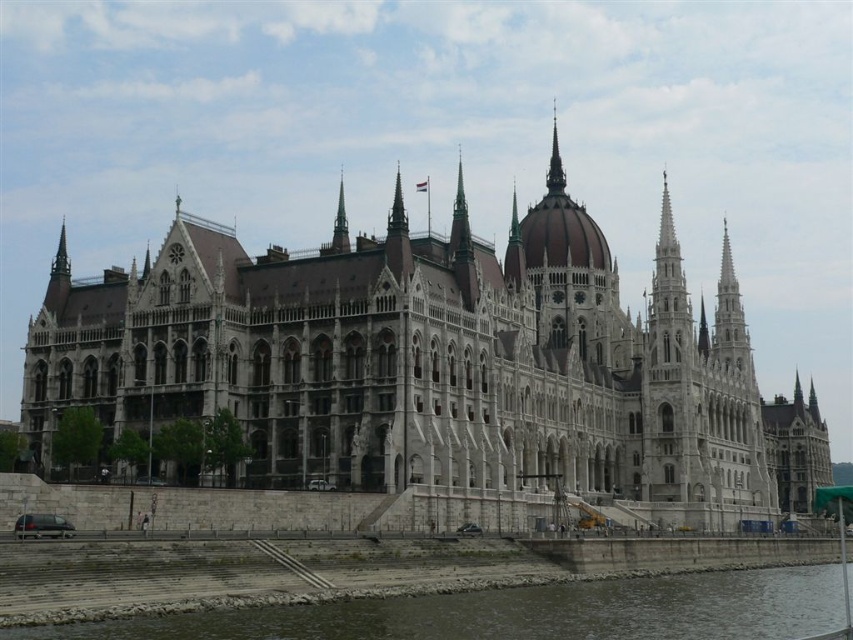
Describe the element at coordinates (434, 365) in the screenshot. Image resolution: width=853 pixels, height=640 pixels. I see `white stone palace at center` at that location.

At what (x,y) coordinates should I click in order to perform the action: click on white stone palace at center. Please return your answer as a coordinate pair (x, y). Looking at the image, I should click on (434, 365).

Which is behind, point (749, 490) or point (387, 608)?

Point (749, 490)

Where is `white stone palace at center`? white stone palace at center is located at coordinates (434, 365).

Between white stone tower at center and polished silver spire at upper center, which one has more height?

With more height is white stone tower at center.

Who is shorter, white stone tower at center or polished silver spire at upper center?

Standing shorter between the two is polished silver spire at upper center.

Between point (648, 332) and point (553, 128), which one is positioned behind?

The point (553, 128) is more distant.

At what (x,y) coordinates should I click in order to perform the action: click on white stone tower at center. Please return your answer as a coordinate pair (x, y). Looking at the image, I should click on (672, 390).

Is gray rocky river at lower left to the right of white stone tower at center from the viewer's perspective?

In fact, gray rocky river at lower left is to the left of white stone tower at center.

Where is `gray rocky river at lower left`? The image size is (853, 640). gray rocky river at lower left is located at coordinates (519, 612).